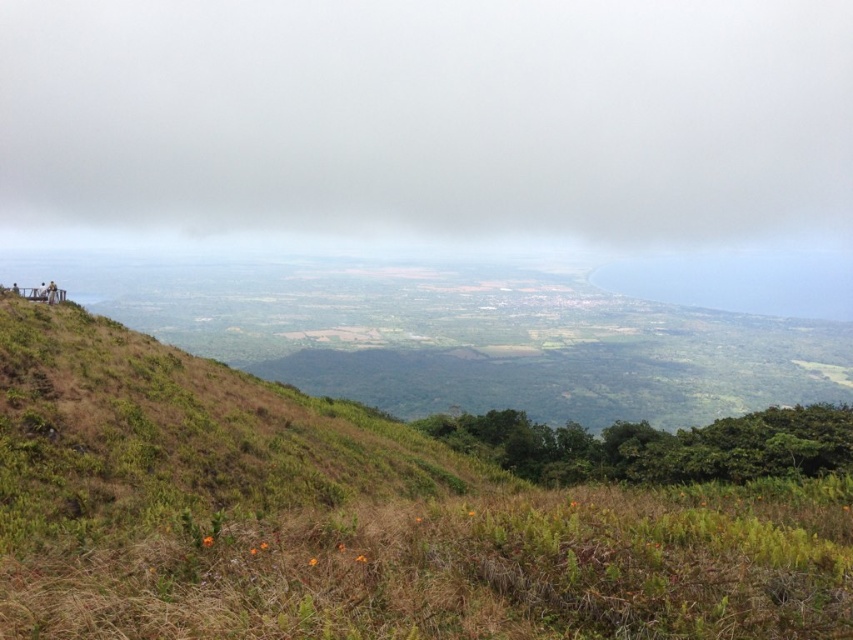
You are standing on a hilltop and looking at the white fluffy cloud at upper center and the dry grass at lower center. Which object is closer to you?

The dry grass at lower center is behind the white fluffy cloud at upper center, so the white fluffy cloud at upper center is closer to you.

You are an airplane pilot flying at an altitude of 10,000 feet. You look out the window and see a point marked at coordinates (428, 116). What object is located at that point?

The point at coordinates (428, 116) indicates a white fluffy cloud at upper center.